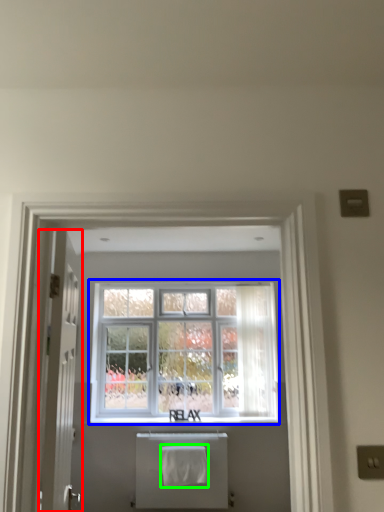
Question: Estimate the real-world distances between objects in this image. Which object is closer to door (highlighted by a red box), window (highlighted by a blue box) or bath towel (highlighted by a green box)?

Choices:
 (A) window
 (B) bath towel

Answer: (B)